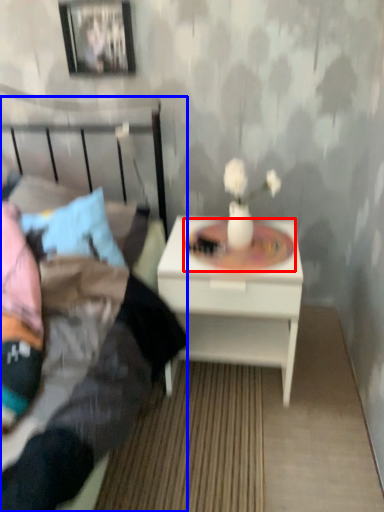
Question: Among these objects, which one is nearest to the camera, round table (highlighted by a red box) or bed (highlighted by a blue box)?

Choices:
 (A) round table
 (B) bed

Answer: (B)